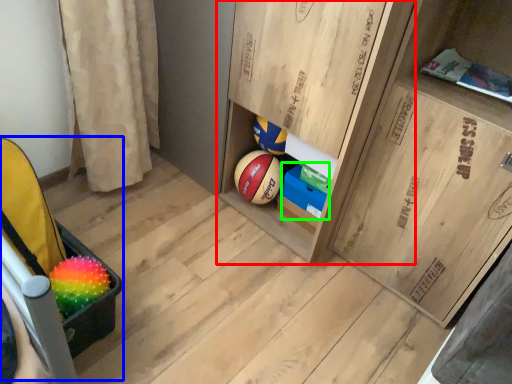
Question: Which is nearer to the cabinetry (highlighted by a red box)? baby carriage (highlighted by a blue box) or cabinetry (highlighted by a green box).

Choices:
 (A) baby carriage
 (B) cabinetry

Answer: (B)